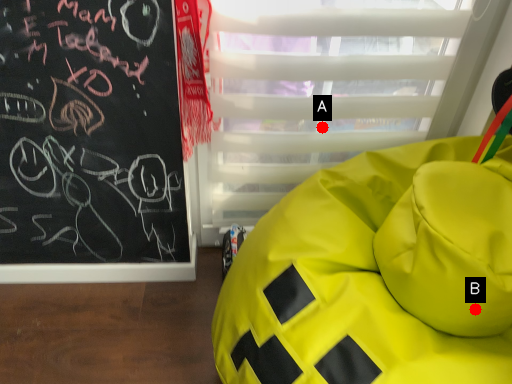
Question: Two points are circled on the image, labeled by A and B beside each circle. Which point is closer to the camera?

Choices:
 (A) A is closer
 (B) B is closer

Answer: (B)